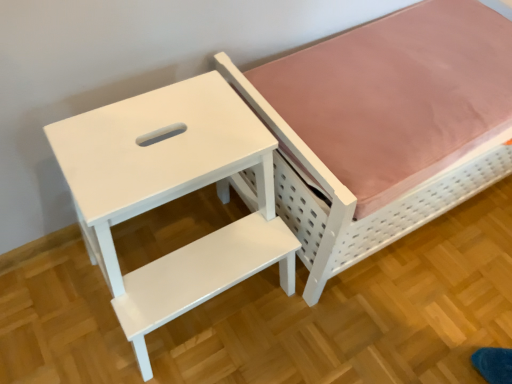
Question: From the image's perspective, is white glossy step stool at upper left located above or below white matte bed at upper right?

Choices:
 (A) below
 (B) above

Answer: (A)

Question: Considering the positions of point click(x=112, y=122) and point click(x=301, y=241), is point click(x=112, y=122) closer or farther from the camera than point click(x=301, y=241)?

Choices:
 (A) closer
 (B) farther

Answer: (A)

Question: Considering the positions of white glossy step stool at upper left and white matte bed at upper right in the image, is white glossy step stool at upper left taller or shorter than white matte bed at upper right?

Choices:
 (A) tall
 (B) short

Answer: (A)

Question: Is white matte bed at upper right wider or thinner than white glossy step stool at upper left?

Choices:
 (A) wide
 (B) thin

Answer: (A)

Question: Is white matte bed at upper right inside the boundaries of white glossy step stool at upper left, or outside?

Choices:
 (A) inside
 (B) outside

Answer: (B)

Question: In the image, is white matte bed at upper right positioned in front of or behind white glossy step stool at upper left?

Choices:
 (A) behind
 (B) front

Answer: (A)

Question: Considering the positions of white matte bed at upper right and white glossy step stool at upper left in the image, is white matte bed at upper right bigger or smaller than white glossy step stool at upper left?

Choices:
 (A) big
 (B) small

Answer: (A)